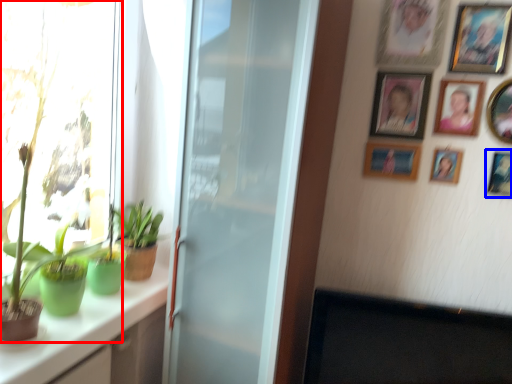
Question: Which of the following is the closest to the observer, houseplant (highlighted by a red box) or picture frame (highlighted by a blue box)?

Choices:
 (A) houseplant
 (B) picture frame

Answer: (A)